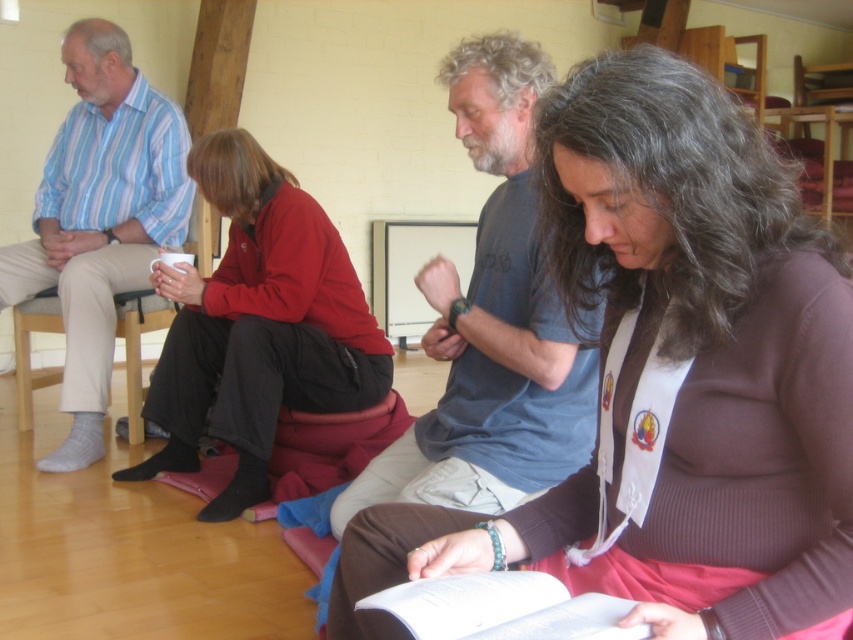
Question: Which of the following is the closest to the observer?

Choices:
 (A) red fleece jacket at center
 (B) striped cotton shirt at left

Answer: (A)

Question: Is striped cotton shirt at left bigger than white paper book at lower center?

Choices:
 (A) yes
 (B) no

Answer: (A)

Question: Which point appears farthest from the camera in this image?

Choices:
 (A) (468, 397)
 (B) (259, 452)
 (C) (666, 636)

Answer: (B)

Question: Estimate the real-world distances between objects in this image. Which object is farther from the striped cotton shirt at left?

Choices:
 (A) dark blue t-shirt at center
 (B) red fleece jacket at center

Answer: (A)

Question: Does brown ribbed sweater at center have a larger size compared to white paper book at lower center?

Choices:
 (A) yes
 (B) no

Answer: (A)

Question: Is brown ribbed sweater at center wider than dark blue t-shirt at center?

Choices:
 (A) no
 (B) yes

Answer: (B)